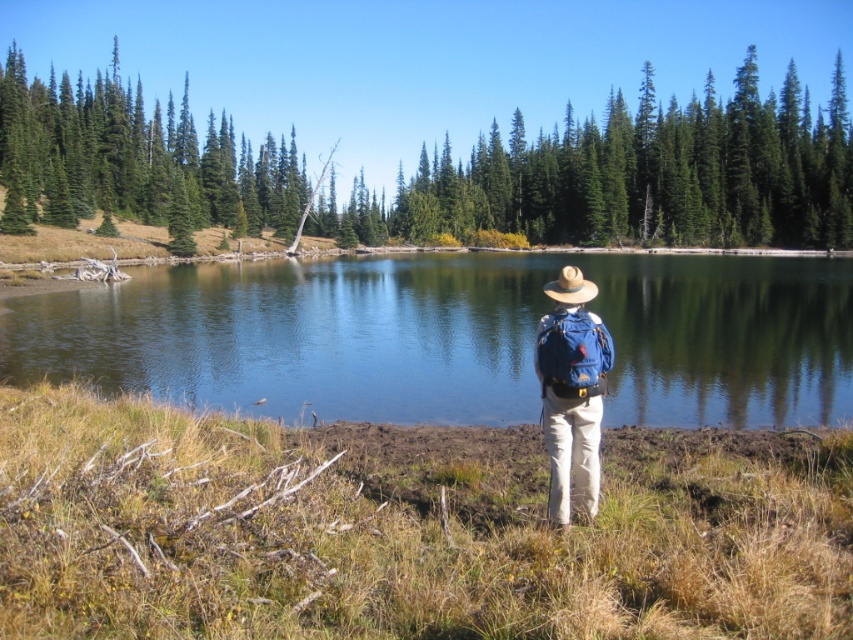
You are a hiker who just finished setting up camp. You need to retrieve your blue fabric backpack at center and brown straw cowboy hat at center. Can you reach both items without moving more than 5 meters from your current position?

The distance between the blue fabric backpack at center and brown straw cowboy hat at center is 5.31 meters. Since this distance exceeds 5 meters, you would need to move more than 5 meters to reach both items.

You are a photographer trying to capture the reflection of the clear water at center in your shot. The brown straw cowboy hat at center is blocking the view. Which object should you move to get a better shot?

The brown straw cowboy hat at center is blocking the view of the clear water at center. Since the clear water at center is closer to the viewer, you should move the brown straw cowboy hat at center to allow the reflection to be visible.

You are a hiker who just arrived at the lake. You need to place your compass on the ground exactly where your blue fabric backpack at center is located. Can you tell me the coordinates where you should place the compass?

The blue fabric backpack at center is located at coordinates point (572,394), so you should place the compass there.